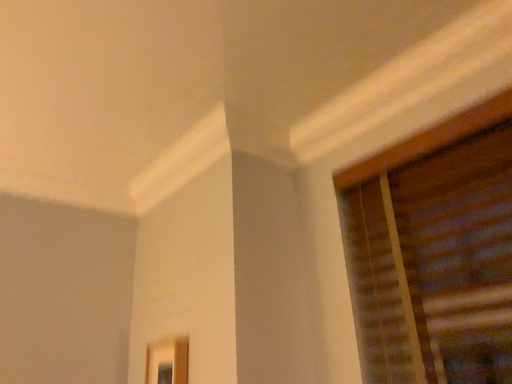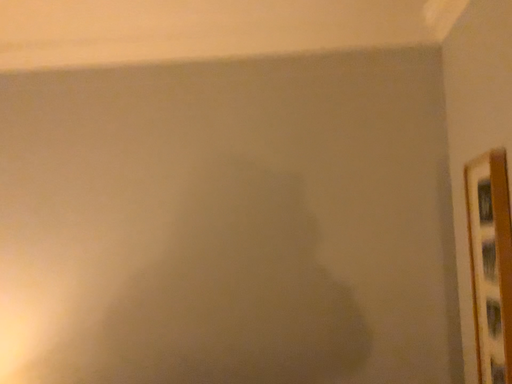
Question: Which way did the camera rotate in the video?

Choices:
 (A) rotated right
 (B) rotated left

Answer: (B)